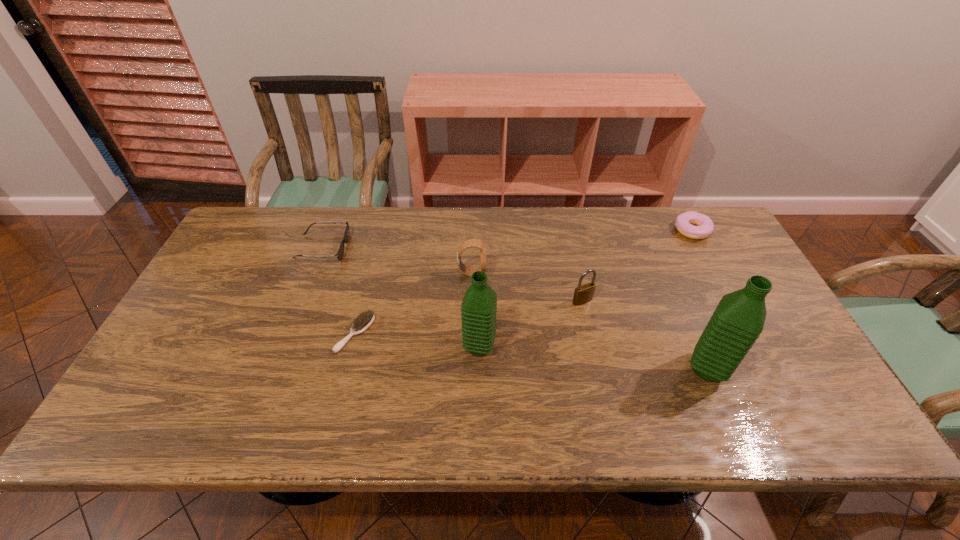
Where is `free space that satisfies the following two spatial constraints: 1. on the face of the shorter water bottle; 2. on the left side of the watch`? The height and width of the screenshot is (540, 960). free space that satisfies the following two spatial constraints: 1. on the face of the shorter water bottle; 2. on the left side of the watch is located at coordinates (470, 347).